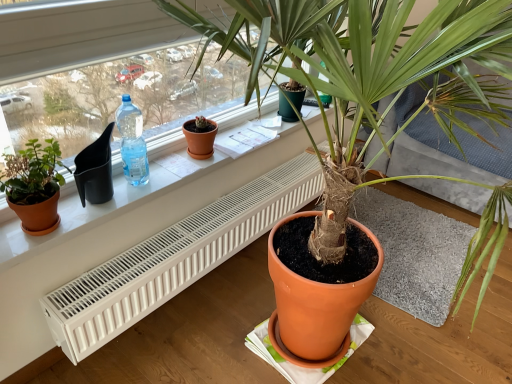
Question: Is point (117, 112) closer or farther from the camera than point (36, 158)?

Choices:
 (A) closer
 (B) farther

Answer: (B)

Question: In terms of height, does translucent plastic bottle at window left look taller or shorter compared to matte terracotta pot at left, positioned as the 1th houseplant in left-to-right order?

Choices:
 (A) tall
 (B) short

Answer: (A)

Question: Estimate the real-world distances between objects in this image. Which object is farther from the matte white radiator at lower center?

Choices:
 (A) white plastic radiator at lower center
 (B) matte orange pot at center, marked as the 2th houseplant in a back-to-front arrangement
 (C) matte black pot at upper left
 (D) matte terracotta pot at left, placed as the 2th houseplant when sorted from front to back
 (E) terracotta clay pot at center

Answer: (B)

Question: Which is nearer to the matte white radiator at lower center?

Choices:
 (A) terracotta clay pot at center
 (B) matte terracotta pot at left, which is the 2th houseplant in right-to-left order
 (C) matte orange pot at center, which is the first houseplant in right-to-left order
 (D) translucent plastic bottle at window left
 (E) matte black pot at upper left

Answer: (D)